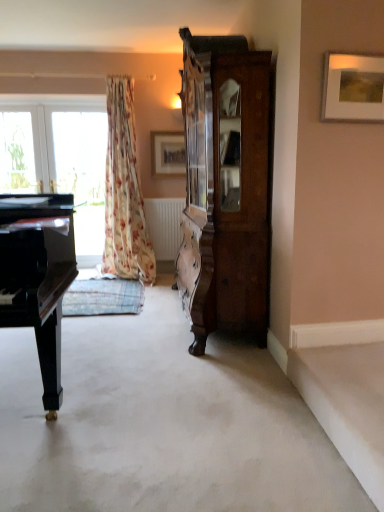
Question: Considering the relative positions of transparent glass window at left and high-gloss black piano at left in the image provided, is transparent glass window at left to the left of high-gloss black piano at left from the viewer's perspective?

Choices:
 (A) no
 (B) yes

Answer: (B)

Question: Can you confirm if transparent glass window at left is taller than high-gloss black piano at left?

Choices:
 (A) no
 (B) yes

Answer: (B)

Question: From a real-world perspective, does transparent glass window at left sit lower than high-gloss black piano at left?

Choices:
 (A) no
 (B) yes

Answer: (A)

Question: Is transparent glass window at left outside high-gloss black piano at left?

Choices:
 (A) yes
 (B) no

Answer: (A)

Question: Does transparent glass window at left contain high-gloss black piano at left?

Choices:
 (A) yes
 (B) no

Answer: (B)

Question: Can you confirm if transparent glass window at left is smaller than high-gloss black piano at left?

Choices:
 (A) no
 (B) yes

Answer: (B)

Question: Are dark wood cabinet at right and white carpet at center making contact?

Choices:
 (A) no
 (B) yes

Answer: (A)

Question: Considering the relative sizes of dark wood cabinet at right and white carpet at center in the image provided, is dark wood cabinet at right taller than white carpet at center?

Choices:
 (A) yes
 (B) no

Answer: (A)

Question: From a real-world perspective, does dark wood cabinet at right stand above white carpet at center?

Choices:
 (A) yes
 (B) no

Answer: (A)

Question: Is dark wood cabinet at right turned away from white carpet at center?

Choices:
 (A) yes
 (B) no

Answer: (B)

Question: Is dark wood cabinet at right behind white carpet at center?

Choices:
 (A) no
 (B) yes

Answer: (B)

Question: Can you confirm if dark wood cabinet at right is thinner than white carpet at center?

Choices:
 (A) yes
 (B) no

Answer: (A)

Question: Is wooden picture frame at center, acting as the 1th picture frame starting from the back, surrounding wooden picture frame at upper right, which appears as the 2th picture frame when viewed from the back?

Choices:
 (A) no
 (B) yes

Answer: (A)